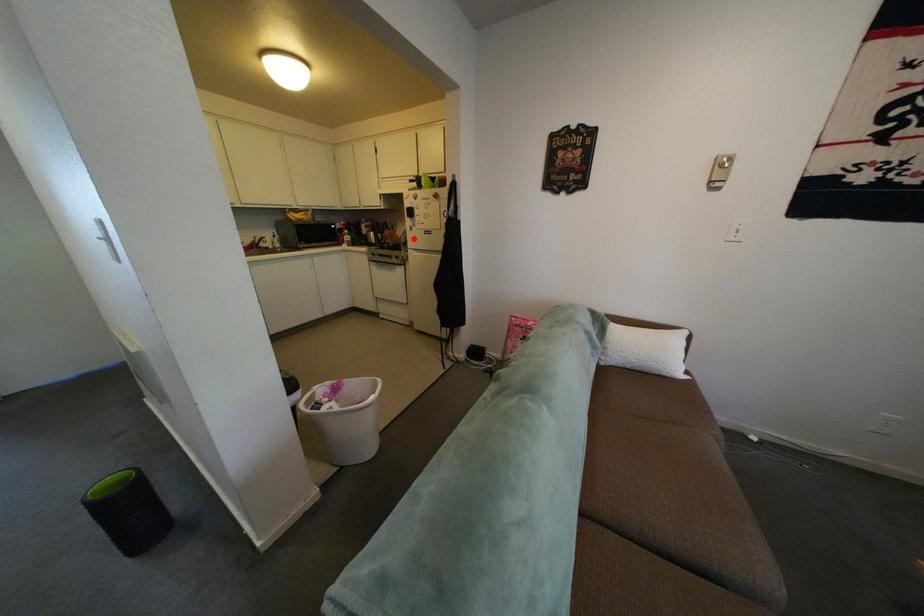
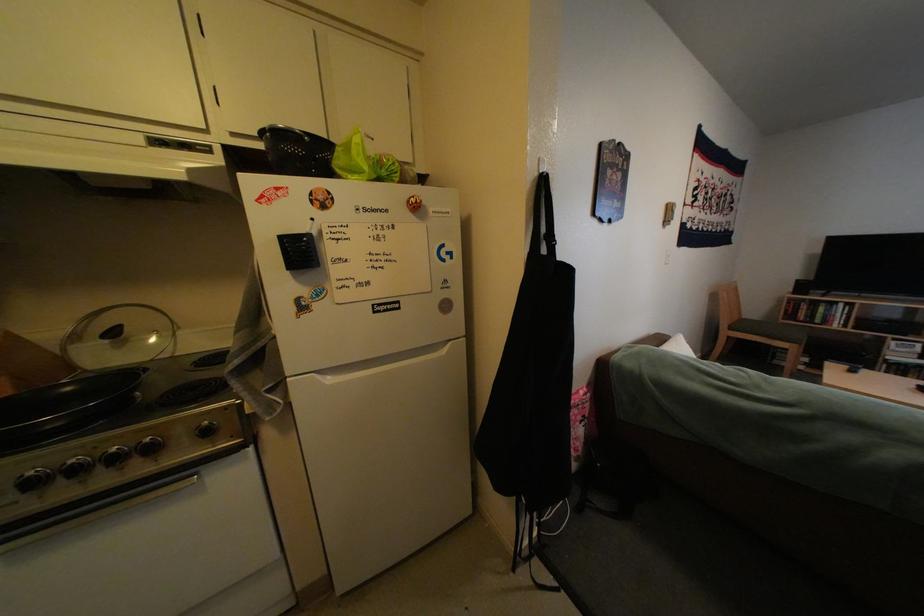
In the second image, find the point that corresponds to the highlighted location in the first image.

(71, 353)